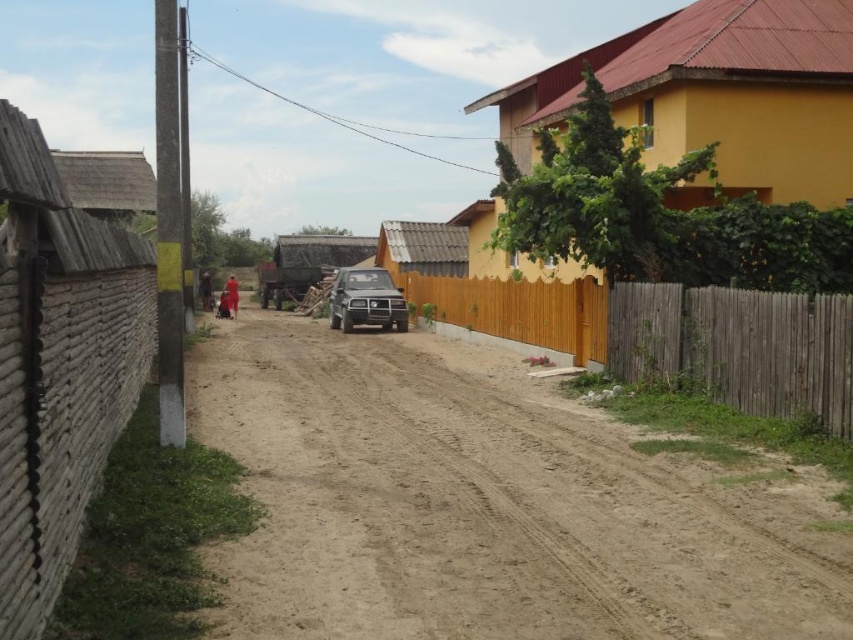
Where is `brown wooden fence at right`? This screenshot has height=640, width=853. brown wooden fence at right is located at coordinates (738, 348).

Does brown wooden fence at right come in front of satin black suv at center?

Yes, it is.

Locate an element on the screen. This screenshot has width=853, height=640. brown wooden fence at right is located at coordinates (738, 348).

Is brown sandy dirt track at center in front of brown wooden fence at right?

Yes, it is.

Can you confirm if brown sandy dirt track at center is positioned to the right of brown wooden fence at right?

Incorrect, brown sandy dirt track at center is not on the right side of brown wooden fence at right.

Measure the distance between brown sandy dirt track at center and camera.

They are 5.15 meters apart.

At what (x,y) coordinates should I click in order to perform the action: click on brown sandy dirt track at center. Please return your answer as a coordinate pair (x, y). The width and height of the screenshot is (853, 640). Looking at the image, I should click on (485, 504).

Is brown sandy dirt track at center to the left of satin black suv at center from the viewer's perspective?

No, brown sandy dirt track at center is not to the left of satin black suv at center.

What do you see at coordinates (485, 504) in the screenshot? I see `brown sandy dirt track at center` at bounding box center [485, 504].

In order to click on brown sandy dirt track at center in this screenshot , I will do `click(485, 504)`.